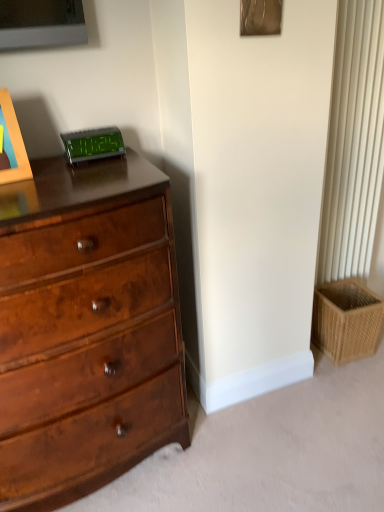
What do you see at coordinates (86, 329) in the screenshot?
I see `shiny brown wood chest of drawers at left` at bounding box center [86, 329].

What do you see at coordinates (346, 320) in the screenshot? I see `woven tan basket at lower right` at bounding box center [346, 320].

Identify the location of shiny brown wood chest of drawers at left. (86, 329).

Considering the relative positions of green digital display at upper center and shiny brown wood chest of drawers at left in the image provided, is green digital display at upper center to the left of shiny brown wood chest of drawers at left from the viewer's perspective?

No.

Identify the location of alarm clock above the shiny brown wood chest of drawers at left (from a real-world perspective). (93, 145).

Could you tell me if green digital display at upper center is facing shiny brown wood chest of drawers at left?

No.

From a real-world perspective, between green digital display at upper center and shiny brown wood chest of drawers at left, who is vertically lower?

shiny brown wood chest of drawers at left, from a real-world perspective.

You are a GUI agent. You are given a task and a screenshot of the screen. Output one action in this format:
    pyautogui.click(x=<x>, y=<y>)
    Task: Click on the basket lying below the green digital display at upper center (from the image's perspective)
    The height and width of the screenshot is (512, 384).
    Given the screenshot: What is the action you would take?
    pyautogui.click(x=346, y=320)

Would you say woven tan basket at lower right is to the left or to the right of green digital display at upper center in the picture?

In the image, woven tan basket at lower right appears on the right side of green digital display at upper center.

How many degrees apart are the facing directions of green digital display at upper center and woven tan basket at lower right?

The angle between the facing direction of green digital display at upper center and the facing direction of woven tan basket at lower right is 6.68 degrees.

Is green digital display at upper center surrounding woven tan basket at lower right?

Definitely not — woven tan basket at lower right is not inside green digital display at upper center.

From their relative heights in the image, would you say green digital display at upper center is taller or shorter than woven tan basket at lower right?

Clearly, green digital display at upper center is shorter compared to woven tan basket at lower right.

Is green digital display at upper center facing towards woven tan basket at lower right?

No, green digital display at upper center is not aimed at woven tan basket at lower right.

At what (x,y) coordinates should I click in order to perform the action: click on chest of drawers that appears on the left of woven tan basket at lower right. Please return your answer as a coordinate pair (x, y). The image size is (384, 512). Looking at the image, I should click on (86, 329).

In the scene shown: Which of these two, shiny brown wood chest of drawers at left or woven tan basket at lower right, is bigger?

shiny brown wood chest of drawers at left is bigger.

Relative to green digital display at upper center, is shiny brown wood chest of drawers at left in front or behind?

Visually, shiny brown wood chest of drawers at left is located in front of green digital display at upper center.

From a real-world perspective, relative to green digital display at upper center, is shiny brown wood chest of drawers at left vertically above or below?

shiny brown wood chest of drawers at left is below green digital display at upper center.

Could green digital display at upper center be considered to be inside shiny brown wood chest of drawers at left?

Actually, green digital display at upper center is outside shiny brown wood chest of drawers at left.

Is point (99, 401) positioned after point (99, 137)?

No, it is not.

Identify the location of chest of drawers that is on the left side of woven tan basket at lower right. The height and width of the screenshot is (512, 384). (86, 329).

Which of these two, woven tan basket at lower right or shiny brown wood chest of drawers at left, stands taller?

With more height is shiny brown wood chest of drawers at left.

Would you say woven tan basket at lower right is outside shiny brown wood chest of drawers at left?

Yes, woven tan basket at lower right is not within shiny brown wood chest of drawers at left.

Find the location of `chest of drawers to the left of green digital display at upper center`. chest of drawers to the left of green digital display at upper center is located at coordinates pos(86,329).

Where is `basket that is below the green digital display at upper center (from the image's perspective)`? Image resolution: width=384 pixels, height=512 pixels. basket that is below the green digital display at upper center (from the image's perspective) is located at coordinates (346, 320).

When comparing their distances from woven tan basket at lower right, does shiny brown wood chest of drawers at left or green digital display at upper center seem closer?

shiny brown wood chest of drawers at left is positioned closer to the anchor woven tan basket at lower right.

When comparing their distances from shiny brown wood chest of drawers at left, does woven tan basket at lower right or green digital display at upper center seem further?

woven tan basket at lower right is further to shiny brown wood chest of drawers at left.

Estimate the real-world distances between objects in this image. Which object is closer to green digital display at upper center, woven tan basket at lower right or shiny brown wood chest of drawers at left?

shiny brown wood chest of drawers at left is positioned closer to the anchor green digital display at upper center.

When comparing their distances from woven tan basket at lower right, does green digital display at upper center or shiny brown wood chest of drawers at left seem closer?

Based on the image, shiny brown wood chest of drawers at left appears to be nearer to woven tan basket at lower right.

Which object lies nearer to the anchor point shiny brown wood chest of drawers at left, green digital display at upper center or woven tan basket at lower right?

Among the two, green digital display at upper center is located nearer to shiny brown wood chest of drawers at left.

From the image, which object appears to be farther from green digital display at upper center, shiny brown wood chest of drawers at left or woven tan basket at lower right?

Based on the image, woven tan basket at lower right appears to be further to green digital display at upper center.

Where is `alarm clock located between shiny brown wood chest of drawers at left and woven tan basket at lower right in the left-right direction`? alarm clock located between shiny brown wood chest of drawers at left and woven tan basket at lower right in the left-right direction is located at coordinates (93, 145).